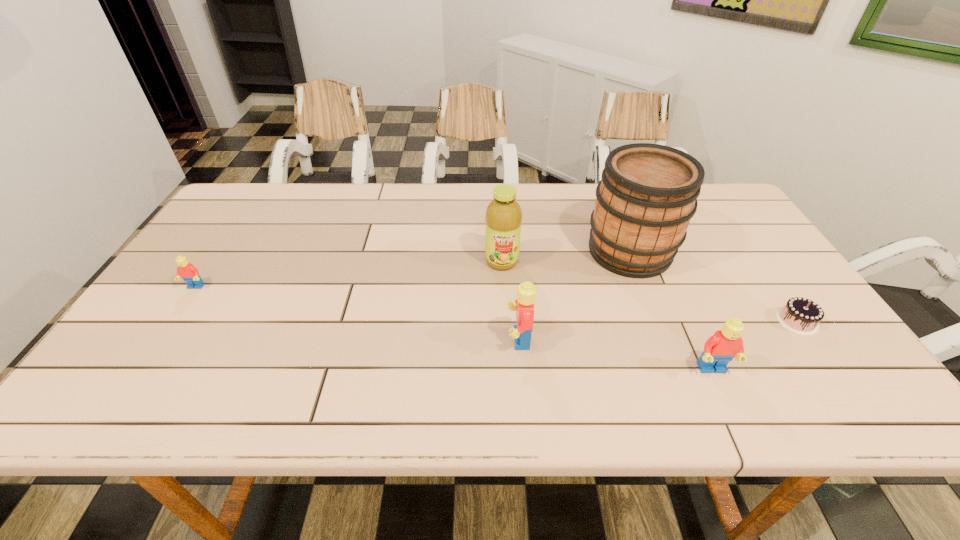
Where is `free location located on the face of the second Lego from right to left`? Image resolution: width=960 pixels, height=540 pixels. free location located on the face of the second Lego from right to left is located at coordinates (472, 339).

In order to click on vacant space located 0.340m on the face of the second Lego from right to left in this screenshot , I will do `click(359, 339)`.

Image resolution: width=960 pixels, height=540 pixels. I want to click on vacant space located on the face of the second Lego from right to left, so click(385, 339).

In order to click on free space located 0.400m on the back of the rightmost object in this screenshot , I will do `click(723, 214)`.

Locate an element on the screen. This screenshot has width=960, height=540. free space located 0.390m on the left of the cider is located at coordinates (448, 251).

Locate an element on the screen. free location located 0.050m on the front label of the second tallest object is located at coordinates (503, 285).

I want to click on object that is at the left edge, so click(x=189, y=273).

The image size is (960, 540). Identify the location of object located at the right edge. (802, 316).

The image size is (960, 540). In order to click on free space at the far edge of the desktop in this screenshot , I will do `click(288, 210)`.

The height and width of the screenshot is (540, 960). I want to click on vacant space at the near edge, so click(x=277, y=370).